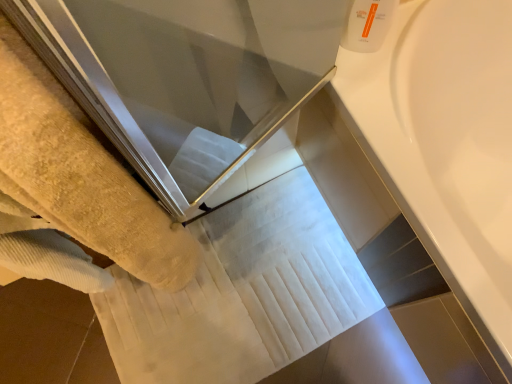
Question: In the image, is white plastic bottle at upper right on the left side or the right side of yellow terry towel at left?

Choices:
 (A) left
 (B) right

Answer: (B)

Question: Is point (386, 29) positioned closer to the camera than point (81, 238)?

Choices:
 (A) closer
 (B) farther

Answer: (B)

Question: Estimate the real-world distances between objects in this image. Which object is closer to the white glossy bathtub at upper right?

Choices:
 (A) yellow terry towel at left
 (B) white plastic bottle at upper right

Answer: (B)

Question: Considering the real-world distances, which object is closest to the white plastic bottle at upper right?

Choices:
 (A) yellow terry towel at left
 (B) white glossy bathtub at upper right

Answer: (B)